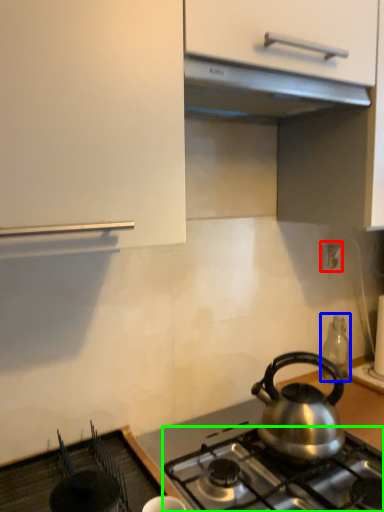
Question: Estimate the real-world distances between objects in this image. Which object is closer to electric outlet (highlighted by a red box), appliance (highlighted by a blue box) or gas stove (highlighted by a green box)?

Choices:
 (A) appliance
 (B) gas stove

Answer: (A)